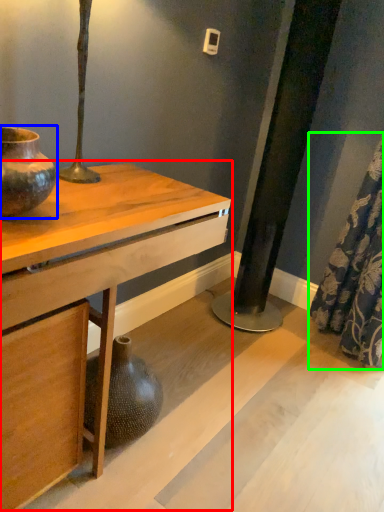
Question: Estimate the real-world distances between objects in this image. Which object is farther from table (highlighted by a red box), vase (highlighted by a blue box) or shower curtain (highlighted by a green box)?

Choices:
 (A) vase
 (B) shower curtain

Answer: (B)